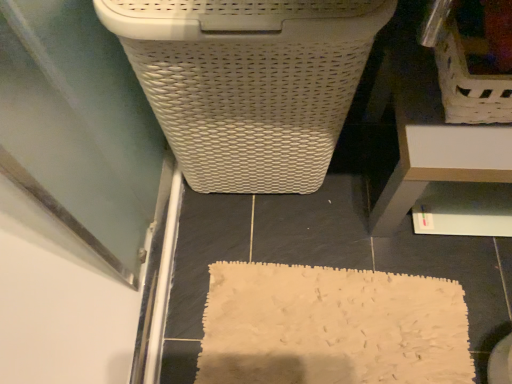
Question: Is white plastic drawer at lower right next to white woven laundry basket at upper center and touching it?

Choices:
 (A) no
 (B) yes

Answer: (A)

Question: Does white plastic drawer at lower right lie behind white woven laundry basket at upper center?

Choices:
 (A) yes
 (B) no

Answer: (A)

Question: Could you tell me if white plastic drawer at lower right is facing white woven laundry basket at upper center?

Choices:
 (A) yes
 (B) no

Answer: (B)

Question: From a real-world perspective, is white plastic drawer at lower right located higher than white woven laundry basket at upper center?

Choices:
 (A) yes
 (B) no

Answer: (B)

Question: From the image's perspective, is white plastic drawer at lower right located beneath white woven laundry basket at upper center?

Choices:
 (A) yes
 (B) no

Answer: (A)

Question: From their relative heights in the image, would you say white woven laundry basket at upper center is taller or shorter than transparent glass screen door at lower left?

Choices:
 (A) tall
 (B) short

Answer: (A)

Question: From the image's perspective, is white woven laundry basket at upper center above or below transparent glass screen door at lower left?

Choices:
 (A) above
 (B) below

Answer: (A)

Question: Considering the positions of point (243, 152) and point (157, 205), is point (243, 152) closer or farther from the camera than point (157, 205)?

Choices:
 (A) farther
 (B) closer

Answer: (B)

Question: Is white woven laundry basket at upper center inside or outside of transparent glass screen door at lower left?

Choices:
 (A) inside
 (B) outside

Answer: (B)

Question: Is white plastic drawer at lower right in front of or behind white woven laundry basket at upper center in the image?

Choices:
 (A) behind
 (B) front

Answer: (A)

Question: Based on their sizes in the image, would you say white plastic drawer at lower right is bigger or smaller than white woven laundry basket at upper center?

Choices:
 (A) small
 (B) big

Answer: (A)

Question: Choose the correct answer: Is white plastic drawer at lower right inside white woven laundry basket at upper center or outside it?

Choices:
 (A) inside
 (B) outside

Answer: (B)

Question: From the image's perspective, is white plastic drawer at lower right above or below white woven laundry basket at upper center?

Choices:
 (A) below
 (B) above

Answer: (A)

Question: Which is correct: white wicker laundry basket at upper right is inside white plastic drawer at lower right, or outside of it?

Choices:
 (A) outside
 (B) inside

Answer: (A)

Question: From their relative heights in the image, would you say white wicker laundry basket at upper right is taller or shorter than white plastic drawer at lower right?

Choices:
 (A) short
 (B) tall

Answer: (A)